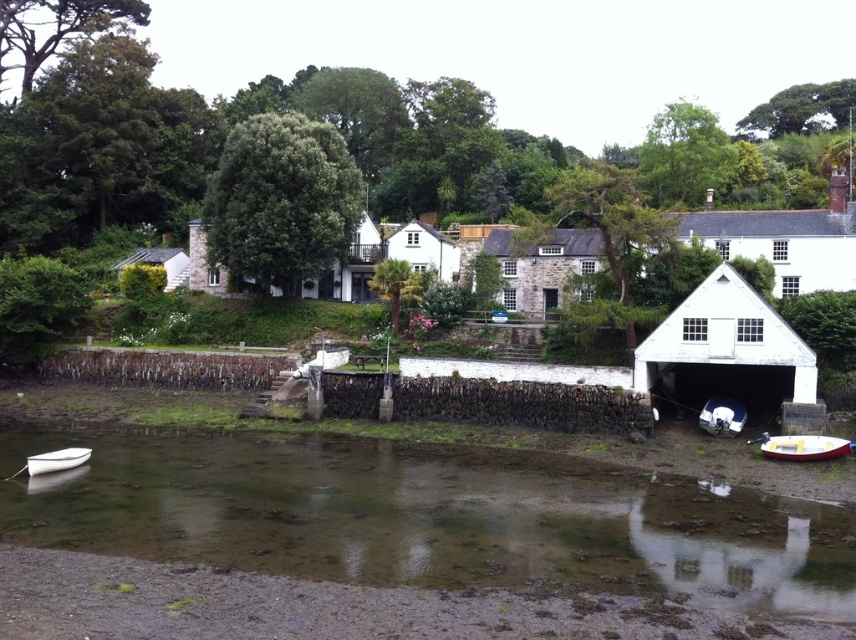
Question: Does white glossy boat at lower right have a greater width compared to white matte boat at lower left?

Choices:
 (A) no
 (B) yes

Answer: (B)

Question: Which object is the closest to the clear water at lower center?

Choices:
 (A) white glossy boat at lower right
 (B) white plastic boat at lower right

Answer: (B)

Question: Where is white glossy boat at lower right located in relation to white matte boat at lower left in the image?

Choices:
 (A) above
 (B) below

Answer: (A)

Question: Which object is closer to the camera taking this photo?

Choices:
 (A) white glossy boat at lower right
 (B) clear water at lower center

Answer: (B)

Question: Can you confirm if white glossy boat at lower right is wider than white matte boat at lower left?

Choices:
 (A) yes
 (B) no

Answer: (A)

Question: Which object is closer to the camera taking this photo?

Choices:
 (A) white plastic boat at lower right
 (B) white glossy boat at lower right
 (C) clear water at lower center
 (D) white matte boat at lower left

Answer: (C)